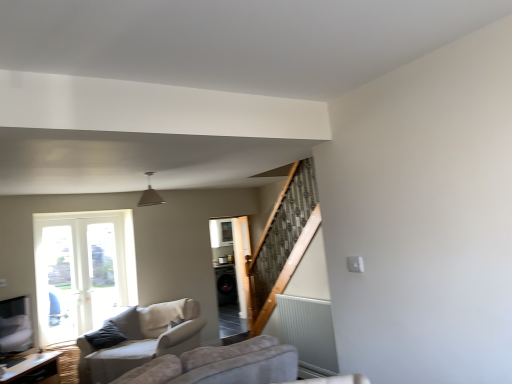
Question: From the image's perspective, relative to black glossy screen door at center, is wooden table at lower left above or below?

Choices:
 (A) below
 (B) above

Answer: (A)

Question: From a real-world perspective, is wooden table at lower left physically located above or below black glossy screen door at center?

Choices:
 (A) above
 (B) below

Answer: (B)

Question: Based on their relative distances, which object is nearer to the matte gray pendant light at center?

Choices:
 (A) beige fabric couch at lower left
 (B) black glossy screen door at center
 (C) wooden table at lower left

Answer: (A)

Question: Based on their relative distances, which object is farther from the black glossy screen door at center?

Choices:
 (A) wooden table at lower left
 (B) matte gray pendant light at center
 (C) beige fabric couch at lower left

Answer: (A)